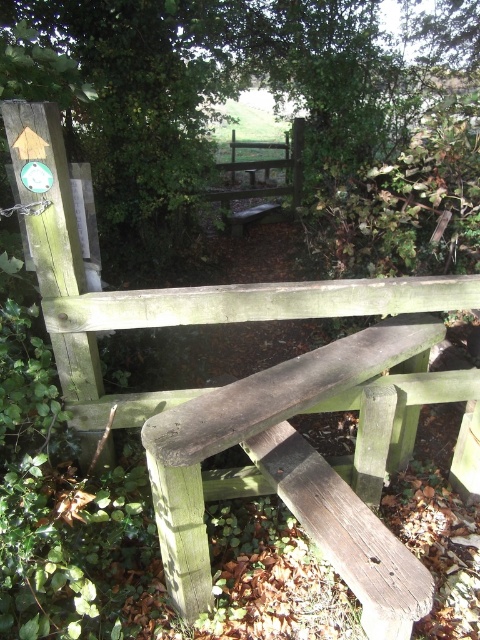
Does green leafy tree at upper left have a lesser width compared to dark brown wood bench at center?

No.

How much distance is there between green leafy tree at upper left and dark brown wood bench at center?

A distance of 2.68 meters exists between green leafy tree at upper left and dark brown wood bench at center.

Which is in front, point (192, 3) or point (188, 522)?

Positioned in front is point (188, 522).

Find the location of a particular element. This screenshot has height=640, width=480. green leafy tree at upper left is located at coordinates (223, 97).